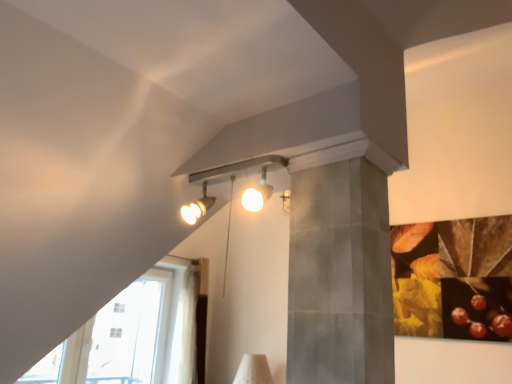
Question: From the image's perspective, is matte silver track lights at upper center positioned above or below transparent glass door at lower left?

Choices:
 (A) below
 (B) above

Answer: (B)

Question: In terms of size, does matte silver track lights at upper center appear bigger or smaller than transparent glass door at lower left?

Choices:
 (A) big
 (B) small

Answer: (B)

Question: Which is correct: matte silver track lights at upper center is inside transparent glass door at lower left, or outside of it?

Choices:
 (A) outside
 (B) inside

Answer: (A)

Question: From the image's perspective, is transparent glass door at lower left located above or below matte silver track lights at upper center?

Choices:
 (A) above
 (B) below

Answer: (B)

Question: In terms of width, does transparent glass door at lower left look wider or thinner when compared to matte silver track lights at upper center?

Choices:
 (A) thin
 (B) wide

Answer: (A)

Question: Is transparent glass door at lower left situated inside matte silver track lights at upper center or outside?

Choices:
 (A) outside
 (B) inside

Answer: (A)

Question: Considering their positions, is transparent glass door at lower left located in front of or behind matte silver track lights at upper center?

Choices:
 (A) front
 (B) behind

Answer: (B)